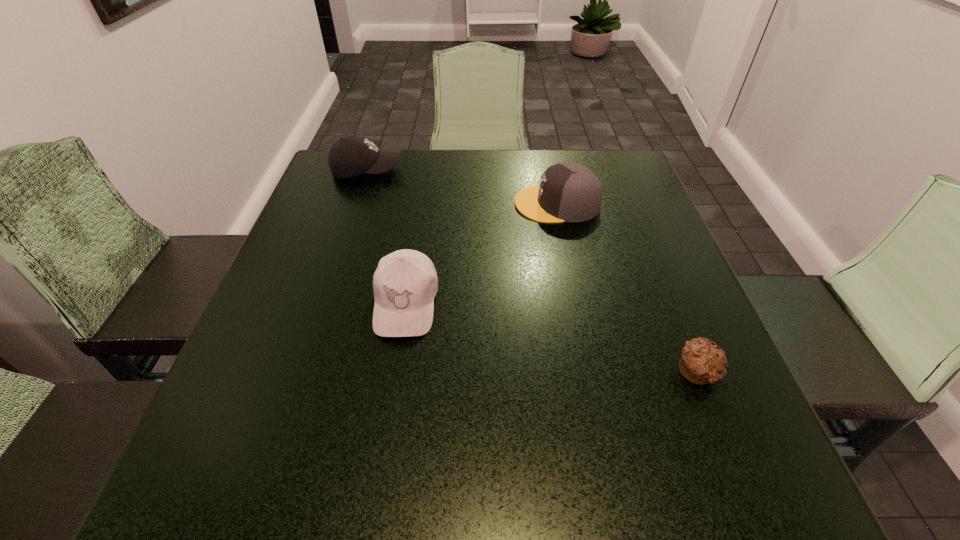
The image size is (960, 540). What are the coordinates of `vacant space that satisfies the following two spatial constraints: 1. on the front-facing side of the rightmost object; 2. on the left side of the third farthest object` in the screenshot? It's located at (395, 372).

This screenshot has height=540, width=960. Identify the location of vacant area that satisfies the following two spatial constraints: 1. on the front-facing side of the shortest object; 2. on the left side of the second nearest object. (395, 372).

The height and width of the screenshot is (540, 960). In order to click on free space that satisfies the following two spatial constraints: 1. on the front-facing side of the leftmost object; 2. on the back side of the rightmost object in this screenshot , I will do `click(299, 372)`.

You are a GUI agent. You are given a task and a screenshot of the screen. Output one action in this format:
    pyautogui.click(x=<x>, y=<y>)
    Task: Click on the free space that satisfies the following two spatial constraints: 1. on the back side of the rightmost object; 2. on the front-facing side of the cap
    
    Given the screenshot: What is the action you would take?
    pyautogui.click(x=631, y=204)

Find the location of a particular element. This screenshot has height=540, width=960. free space that satisfies the following two spatial constraints: 1. on the front-facing side of the nearest object; 2. on the right side of the third object from left to right is located at coordinates (591, 372).

Locate an element on the screen. free space that satisfies the following two spatial constraints: 1. on the front-facing side of the nearest object; 2. on the right side of the third object from right to left is located at coordinates (395, 372).

This screenshot has height=540, width=960. Identify the location of vacant position in the image that satisfies the following two spatial constraints: 1. on the front-facing side of the farthest object; 2. on the back side of the muffin. (299, 372).

Identify the location of vacant space that satisfies the following two spatial constraints: 1. on the back side of the rightmost object; 2. on the front-facing side of the second farthest object. 631,204.